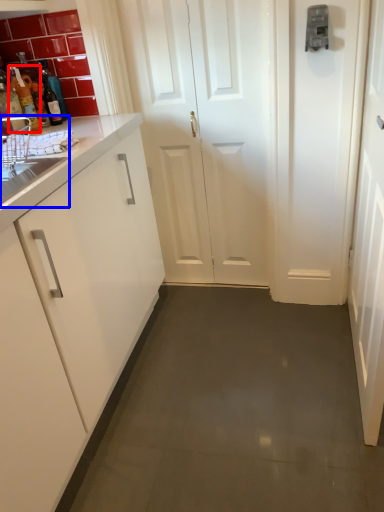
Question: Which of the following is the farthest to the observer, bottle (highlighted by a red box) or sink (highlighted by a blue box)?

Choices:
 (A) bottle
 (B) sink

Answer: (A)